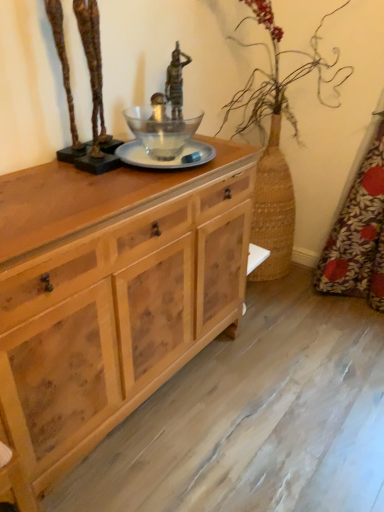
Question: Relative to bronze statue at center, is bronze sculpture at upper left in front or behind?

Choices:
 (A) front
 (B) behind

Answer: (A)

Question: Is bronze sculpture at upper left inside the boundaries of bronze statue at center, or outside?

Choices:
 (A) outside
 (B) inside

Answer: (A)

Question: Estimate the real-world distances between objects in this image. Which object is farther from the bronze statue at center?

Choices:
 (A) natural wood cabinet at center
 (B) floral fabric at right
 (C) bronze sculpture at upper left

Answer: (B)

Question: Estimate the real-world distances between objects in this image. Which object is farther from the bronze sculpture at upper left?

Choices:
 (A) floral fabric at right
 (B) natural wood cabinet at center
 (C) bronze statue at center

Answer: (A)